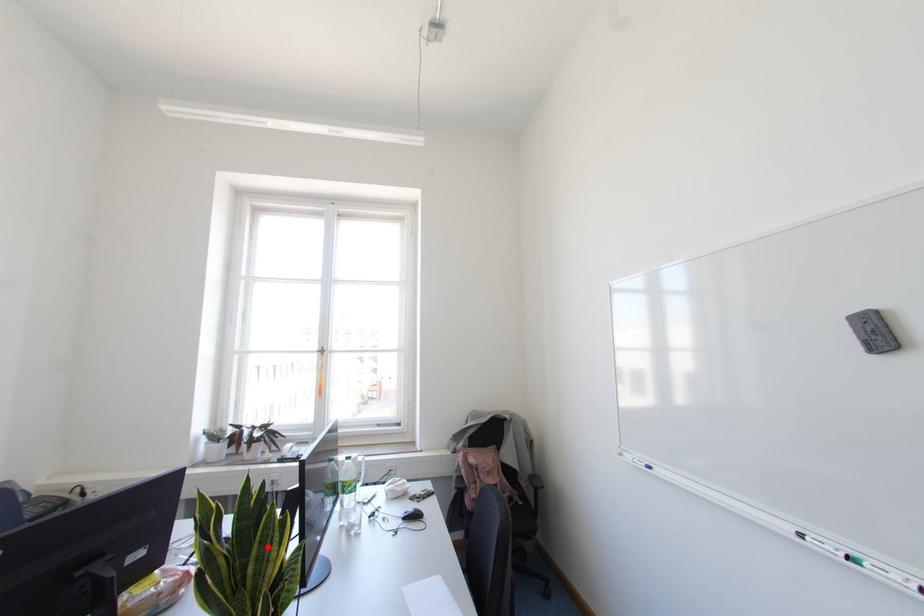
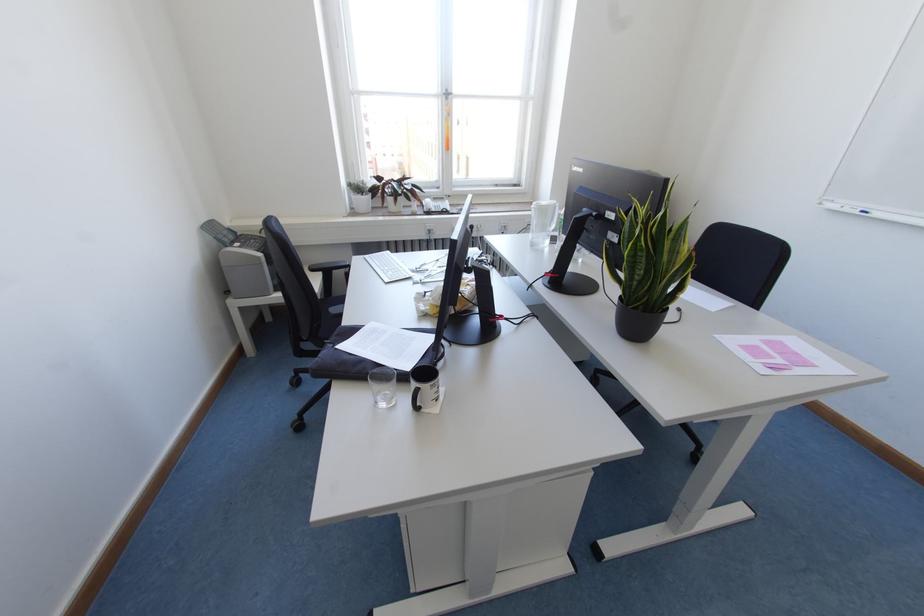
Where in the second image is the point corresponding to the highlighted location from the first image?

(677, 243)